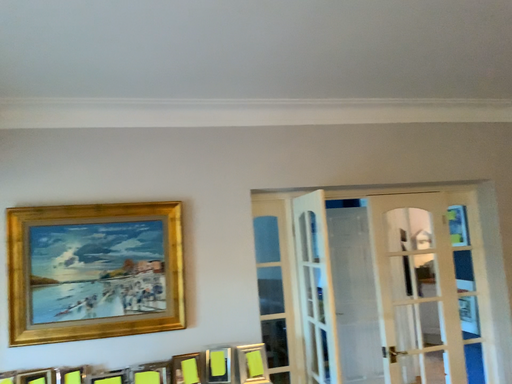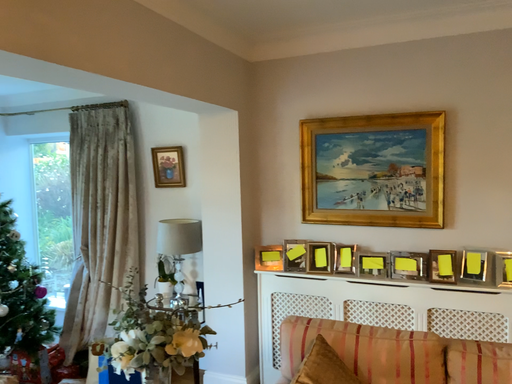
Question: How did the camera likely rotate when shooting the video?

Choices:
 (A) rotated upward
 (B) rotated downward

Answer: (B)